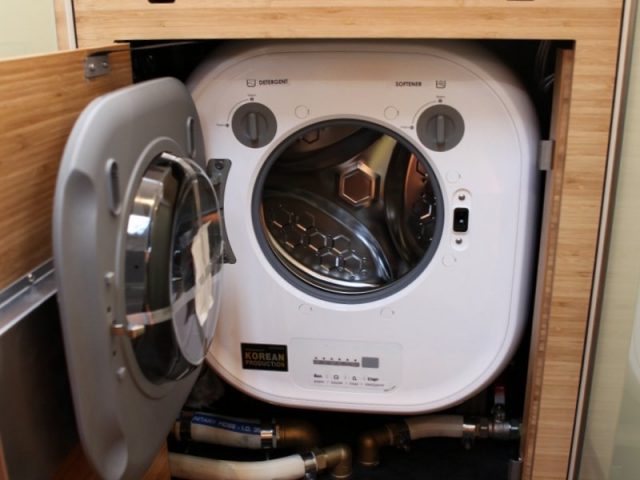
This screenshot has width=640, height=480. I want to click on clear window on washing machine door, so click(173, 297), click(172, 214), click(202, 264).